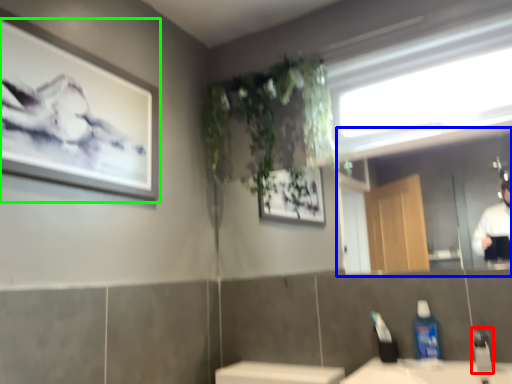
Question: Which object is the closest to the faucet (highlighted by a red box)? Choose among these: mirror (highlighted by a blue box) or picture frame (highlighted by a green box).

Choices:
 (A) mirror
 (B) picture frame

Answer: (B)